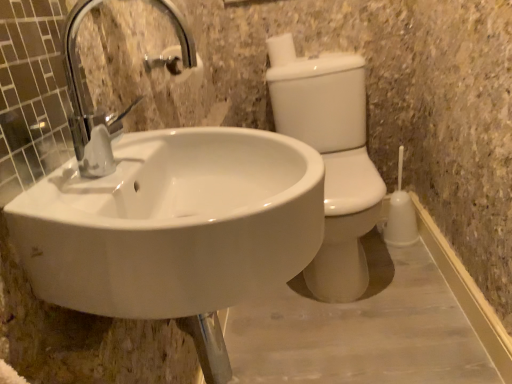
Question: Is white glossy sink at center looking in the opposite direction of white matte toilet paper at upper center?

Choices:
 (A) no
 (B) yes

Answer: (A)

Question: Considering the relative sizes of white glossy sink at center and white matte toilet paper at upper center in the image provided, is white glossy sink at center taller than white matte toilet paper at upper center?

Choices:
 (A) no
 (B) yes

Answer: (B)

Question: Considering the relative positions of white glossy sink at center and white matte toilet paper at upper center in the image provided, is white glossy sink at center to the right of white matte toilet paper at upper center from the viewer's perspective?

Choices:
 (A) yes
 (B) no

Answer: (B)

Question: Is white glossy sink at center next to white matte toilet paper at upper center?

Choices:
 (A) no
 (B) yes

Answer: (A)

Question: Is white matte toilet paper at upper center surrounded by white glossy sink at center?

Choices:
 (A) yes
 (B) no

Answer: (B)

Question: From a real-world perspective, does white glossy sink at center sit lower than white matte toilet paper at upper center?

Choices:
 (A) yes
 (B) no

Answer: (A)

Question: Is white glossy toilet bowl at right oriented towards white glossy sink at center?

Choices:
 (A) yes
 (B) no

Answer: (A)

Question: From the image's perspective, is white glossy toilet bowl at right under white glossy sink at center?

Choices:
 (A) no
 (B) yes

Answer: (A)

Question: Can you confirm if white glossy toilet bowl at right is shorter than white glossy sink at center?

Choices:
 (A) no
 (B) yes

Answer: (A)

Question: Is the surface of white glossy toilet bowl at right in direct contact with white glossy sink at center?

Choices:
 (A) yes
 (B) no

Answer: (B)

Question: Is white glossy toilet bowl at right far from white glossy sink at center?

Choices:
 (A) no
 (B) yes

Answer: (A)

Question: From a real-world perspective, does white glossy toilet bowl at right stand above white glossy sink at center?

Choices:
 (A) no
 (B) yes

Answer: (A)

Question: Would you consider white glossy toilet bowl at right to be distant from white matte toilet paper at upper center?

Choices:
 (A) no
 (B) yes

Answer: (A)